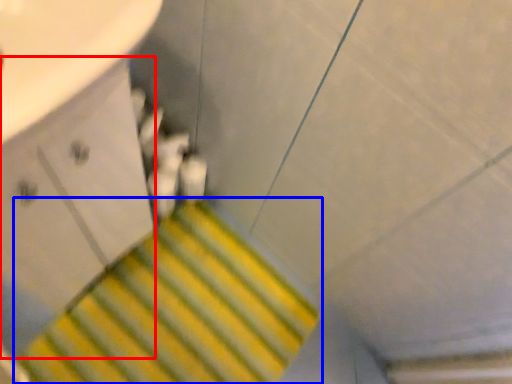
Question: Which object appears farthest to the camera in this image, drawer (highlighted by a red box) or stairs (highlighted by a blue box)?

Choices:
 (A) drawer
 (B) stairs

Answer: (B)